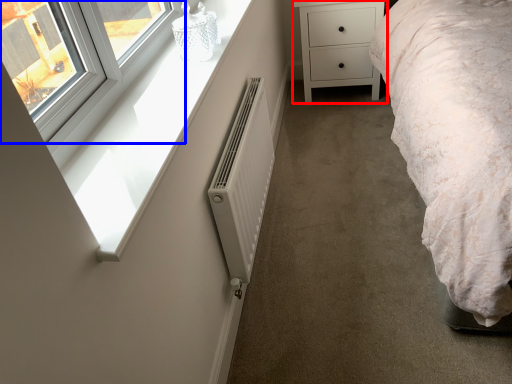
Question: Which of the following is the farthest to the observer, chest of drawers (highlighted by a red box) or window (highlighted by a blue box)?

Choices:
 (A) chest of drawers
 (B) window

Answer: (A)